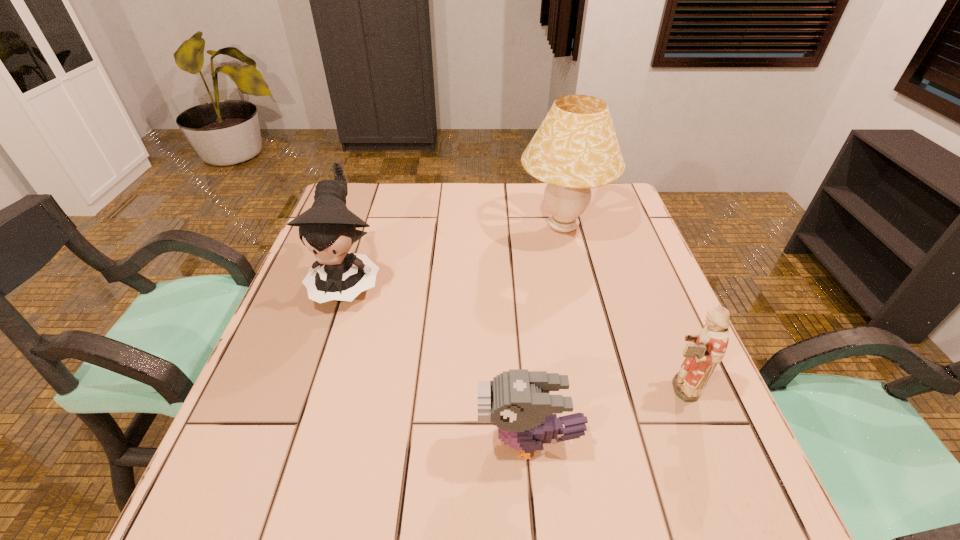
You are a GUI agent. You are given a task and a screenshot of the screen. Output one action in this format:
    pyautogui.click(x=<x>, y=<y>)
    Task: Click on the vacant region at the far edge of the desktop
    
    Given the screenshot: What is the action you would take?
    pyautogui.click(x=539, y=207)

Find the location of a particular element. The width and height of the screenshot is (960, 540). vacant space at the near edge is located at coordinates (512, 491).

Find the location of a particular element. This screenshot has width=960, height=540. vacant area at the right edge is located at coordinates (615, 308).

Locate an element on the screen. The height and width of the screenshot is (540, 960). vacant space that's between the bird and the tallest object is located at coordinates (546, 334).

The height and width of the screenshot is (540, 960). I want to click on free space that is in between the tallest object and the bird, so click(546, 334).

Where is `vacant space that is in between the leftmost object and the lampshade`? The image size is (960, 540). vacant space that is in between the leftmost object and the lampshade is located at coordinates (455, 253).

Where is `free space that is in between the third tallest object and the tallest object`? free space that is in between the third tallest object and the tallest object is located at coordinates (620, 307).

The height and width of the screenshot is (540, 960). What are the coordinates of `vacant space in between the lampshade and the second shortest object` in the screenshot? It's located at (620, 307).

Locate an element on the screen. free space between the second shortest object and the leftmost object is located at coordinates (513, 334).

Identify the location of free spot between the lampshade and the leftmost object. The height and width of the screenshot is (540, 960). tap(455, 253).